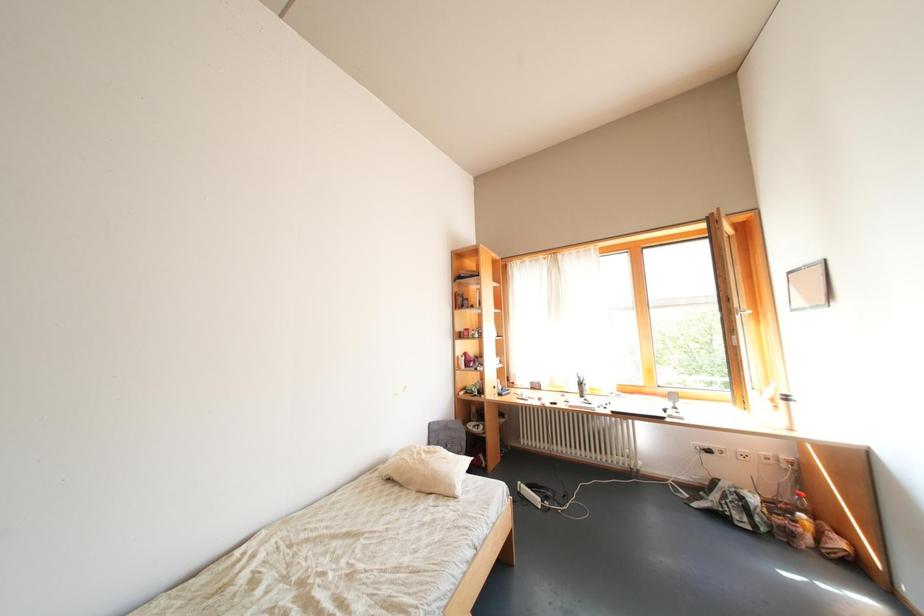
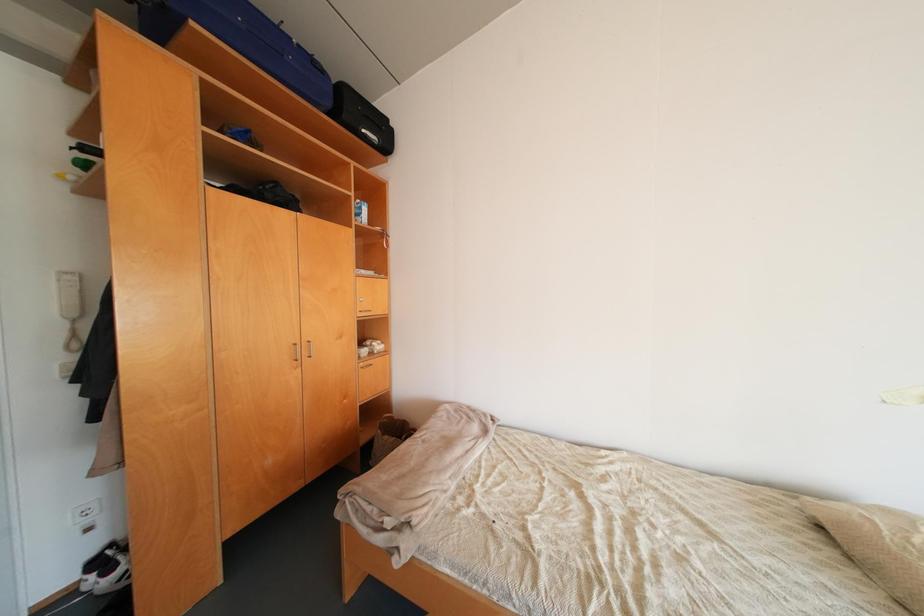
Question: Based on the continuous images, in which direction is the camera rotating? Reply with the corresponding letter.

Choices:
 (A) Left
 (B) Right
 (C) Up
 (D) Down

Answer: (A)